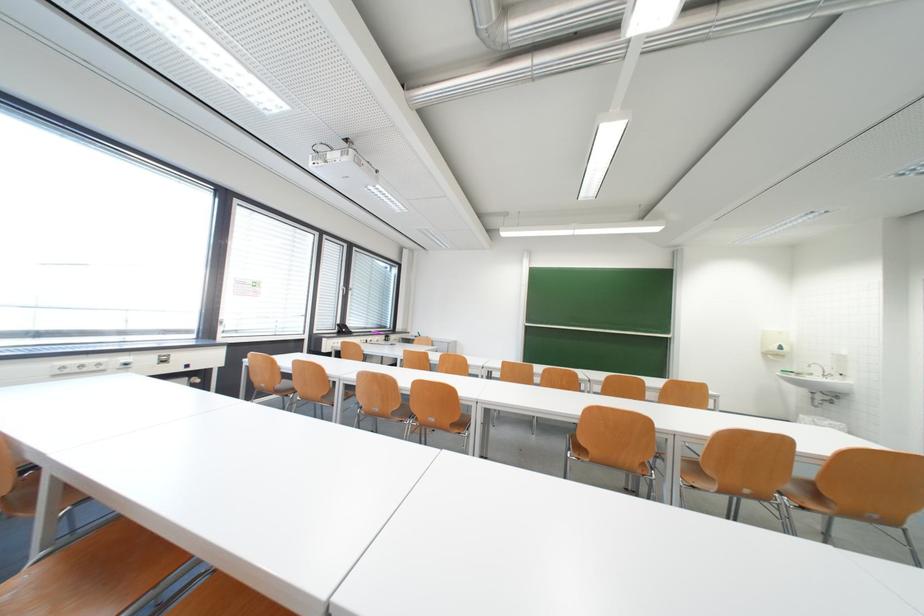
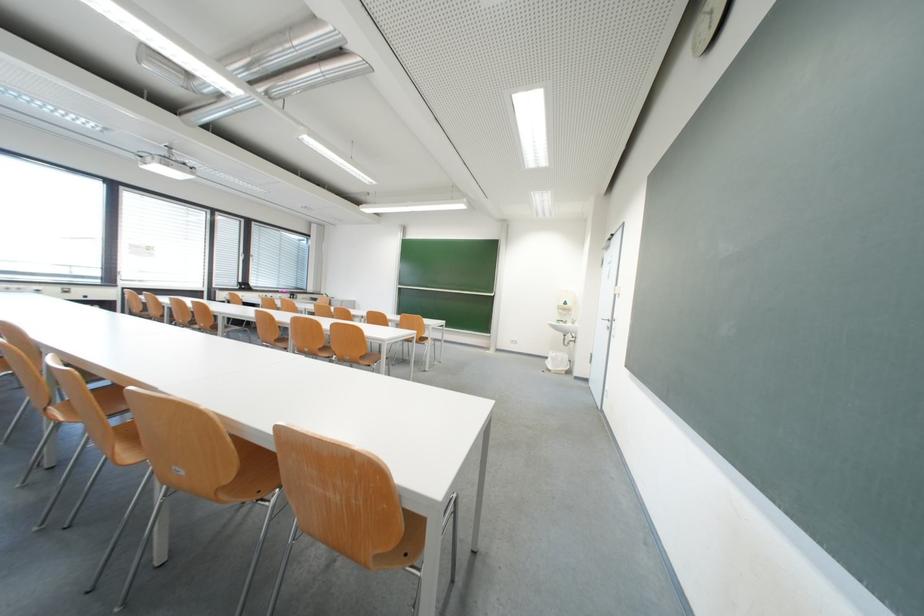
The point at (800, 378) is marked in the first image. Where is the corresponding point in the second image?

(570, 326)